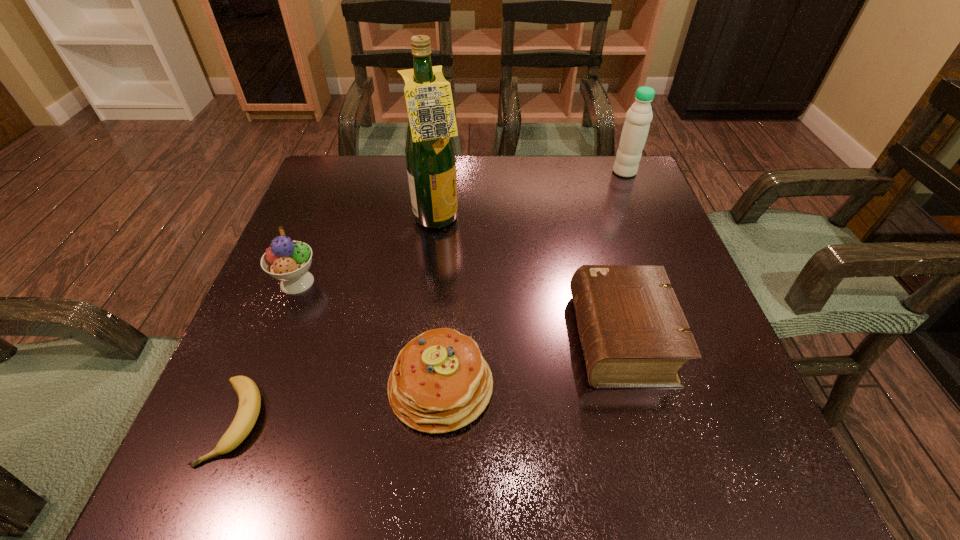
Where is `vacant area located on the right of the fourth shortest object`? The width and height of the screenshot is (960, 540). vacant area located on the right of the fourth shortest object is located at coordinates (435, 282).

Identify the location of vacant region located on the spine side of the fifth object from left to right. This screenshot has height=540, width=960. (425, 338).

Locate an element on the screen. This screenshot has width=960, height=540. vacant space located on the spine side of the fifth object from left to right is located at coordinates (500, 338).

The width and height of the screenshot is (960, 540). What are the coordinates of `free location located on the spine side of the fifth object from left to right` in the screenshot? It's located at (494, 338).

At what (x,y) coordinates should I click in order to perform the action: click on vacant space located on the right of the pancake. Please return your answer as a coordinate pair (x, y). The image size is (960, 540). Looking at the image, I should click on (721, 387).

At what (x,y) coordinates should I click in order to perform the action: click on liquor located in the far edge section of the desktop. Please return your answer as a coordinate pair (x, y). The image size is (960, 540). Looking at the image, I should click on 430,152.

Where is `water bottle present at the far edge`? This screenshot has height=540, width=960. water bottle present at the far edge is located at coordinates (639, 116).

Image resolution: width=960 pixels, height=540 pixels. In order to click on pancake positioned at the near edge in this screenshot , I will do coord(440,382).

Locate an element on the screen. Image resolution: width=960 pixels, height=540 pixels. banana at the near edge is located at coordinates (249, 395).

Image resolution: width=960 pixels, height=540 pixels. I want to click on icecream located in the left edge section of the desktop, so click(288, 261).